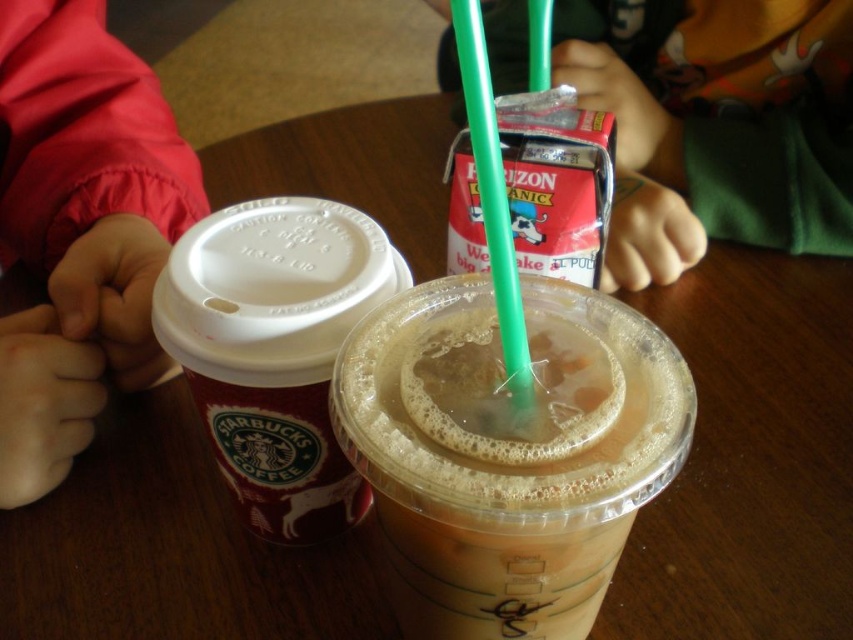
You are holding a ruler and want to measure the distance between the Starbucks coffee cup and the clear plastic cup. The Starbucks cup is at point (508, 429). How far apart are they?

The distance between the Starbucks coffee cup at point (508, 429) and the clear plastic cup is 10.70 inches.

You are organizing a small event and need to stack items from tallest to shortest. Which should come first between the matte red jacket at left and the red matte starbucks coffee cup at left?

The matte red jacket at left should come first since it is taller than the red matte starbucks coffee cup at left.

You are at a cafe and see two green plastic straws on the table. One is the green plastic straw at upper center and the other is the green plastic straw at center. Which one is located more to the right?

The green plastic straw at upper center is positioned on the right side of the green plastic straw at center, so the green plastic straw at upper center is more to the right.